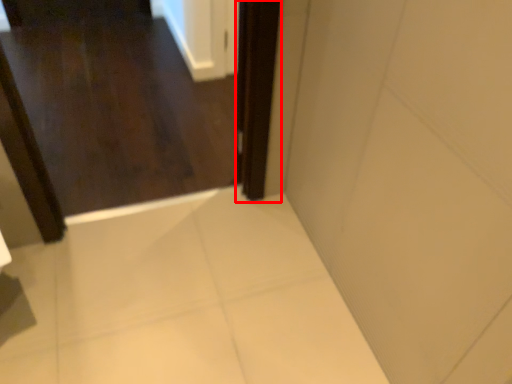
Question: In this image, where is screen door (annotated by the red box) located relative to door?

Choices:
 (A) left
 (B) right

Answer: (B)